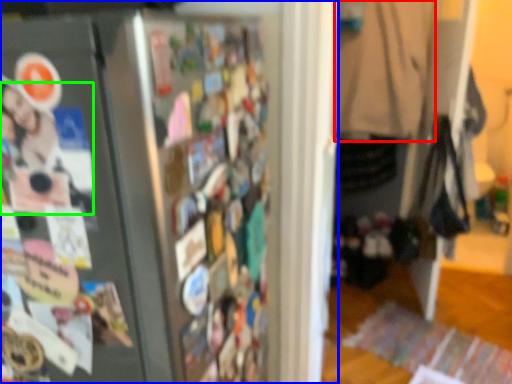
Question: Which object is positioned farthest from clothing (highlighted by a red box)? Select from refrigerator (highlighted by a blue box) and person (highlighted by a green box).

Choices:
 (A) refrigerator
 (B) person

Answer: (B)